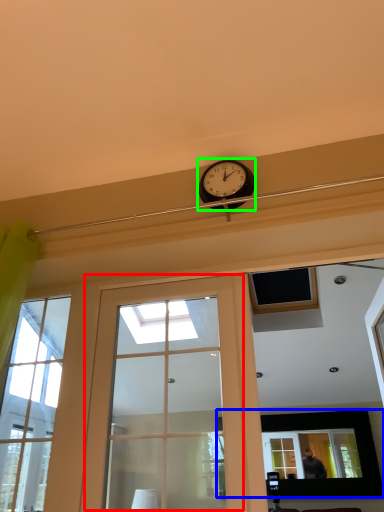
Question: Based on their relative distances, which object is nearer to door (highlighted by a red box)? Choose from picture frame (highlighted by a blue box) and clock (highlighted by a green box).

Choices:
 (A) picture frame
 (B) clock

Answer: (B)